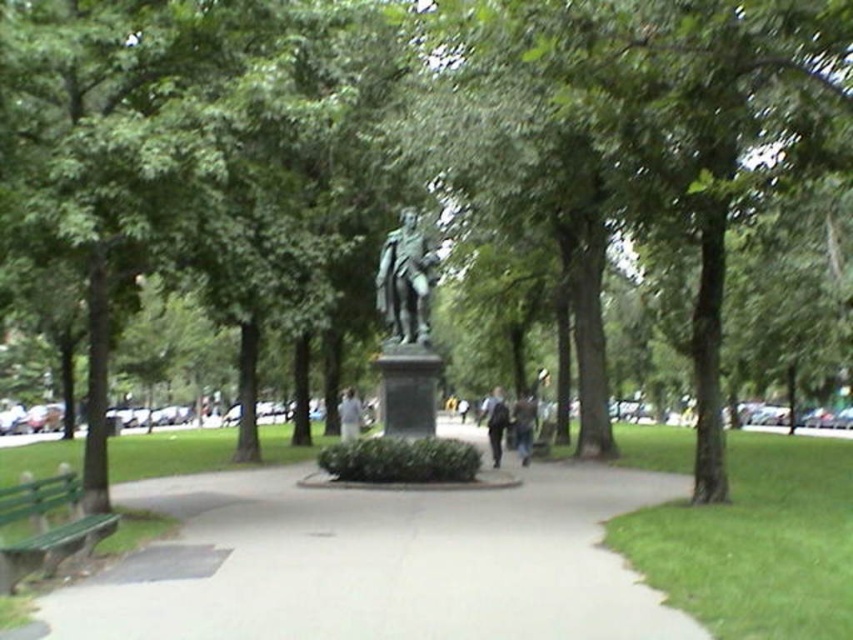
Question: Does smooth concrete pavement at center have a greater width compared to white fabric shirt at center?

Choices:
 (A) no
 (B) yes

Answer: (B)

Question: Is the position of dark blue jeans at center more distant than that of light brown leather jacket at center?

Choices:
 (A) yes
 (B) no

Answer: (B)

Question: Which of these objects is positioned closest to the smooth concrete pavement at center?

Choices:
 (A) bronze statue at center
 (B) green wooden bench at lower left
 (C) dark blue jeans at center
 (D) light brown leather jacket at center

Answer: (A)

Question: Which of these objects is positioned farthest from the light brown leather jacket at center?

Choices:
 (A) dark blue jeans at center
 (B) white fabric shirt at center
 (C) dark gray jacket at center
 (D) smooth concrete pavement at center

Answer: (D)

Question: Among these points, which one is farthest from the camera?

Choices:
 (A) (108, 522)
 (B) (384, 312)
 (C) (486, 413)
 (D) (515, 420)

Answer: (C)

Question: Can you confirm if green wooden bench at lower left is positioned above light brown leather jacket at center?

Choices:
 (A) yes
 (B) no

Answer: (A)